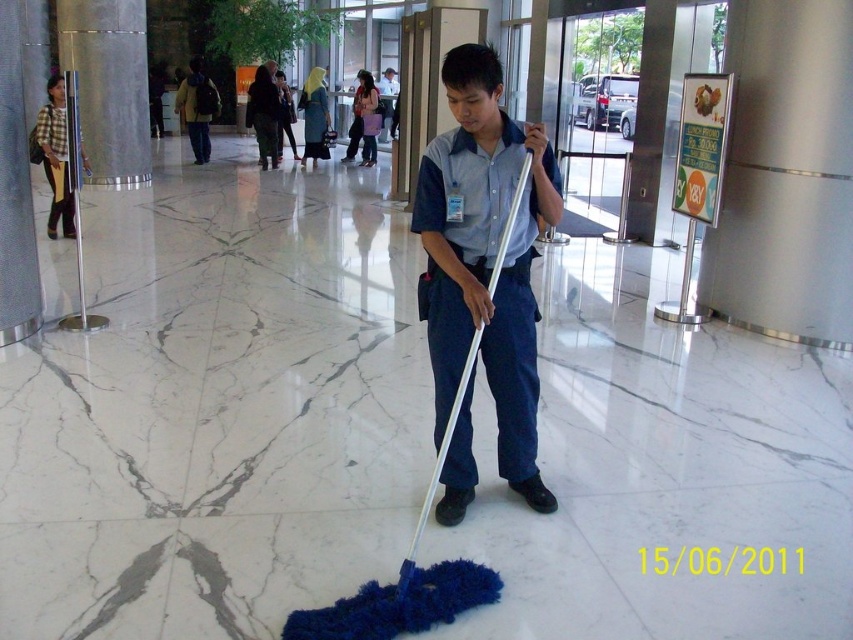
Question: Observing the image, what is the correct spatial positioning of matte black jacket at upper left in reference to light blue shirt at center?

Choices:
 (A) left
 (B) right

Answer: (A)

Question: Is plaid fabric shirt at left closer to the viewer compared to matte black jacket at upper left?

Choices:
 (A) yes
 (B) no

Answer: (A)

Question: Which point appears farthest from the camera in this image?

Choices:
 (A) (177, 96)
 (B) (480, 74)
 (C) (67, 163)
 (D) (392, 115)

Answer: (A)

Question: Which point appears closest to the camera in this image?

Choices:
 (A) (445, 380)
 (B) (79, 157)
 (C) (392, 68)
 (D) (196, 147)

Answer: (A)

Question: In this image, where is plaid fabric shirt at left located relative to matte black jacket at upper left?

Choices:
 (A) left
 (B) right

Answer: (B)

Question: Which point is farther to the camera?

Choices:
 (A) plaid fabric shirt at left
 (B) blue fabric mop at center

Answer: (A)